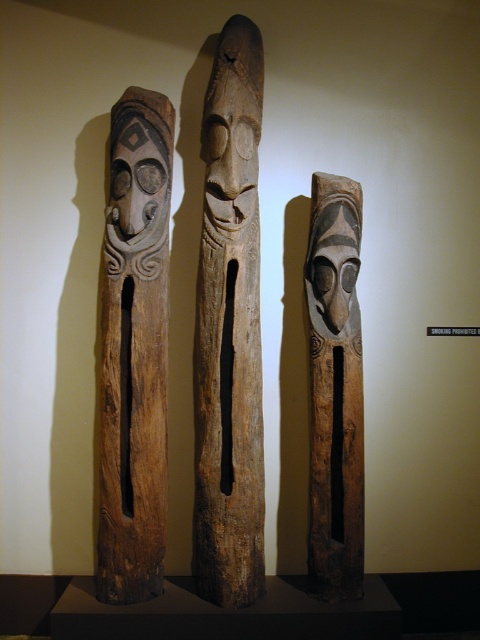
You are an art curator arranging a gallery layout. You need to place a new sculpture between the natural wood totem pole at center and the brown wood carving at left. Based on their current positions, where should you position the new sculpture to maintain symmetry between the three objects?

To maintain symmetry between the natural wood totem pole at center and the brown wood carving at left, the new sculpture should be placed to the right of the natural wood totem pole at center. This is because the natural wood totem pole at center is already positioned to the right of the brown wood carving at left, so adding another object to the right would create a balanced arrangement.

You are standing 2.41 meters away from the point at coordinates (112,220). The totem poles are displayed on a dark pedestal. Can you determine if you are close enough to touch the totem poles?

The point at coordinates (112,220) is 2.41 meters away from you. Since the totem poles are on a pedestal, you are not close enough to touch them from that distance.

You are standing in front of the three totem poles displayed on the dark pedestal. You notice two specific points marked on the image. The first point is at coordinates point [216,188] and the second is at point [117,227]. Which of these points is closer to you?

Point [216,188] is further to the viewer than point [117,227], so the second point is closer to you.